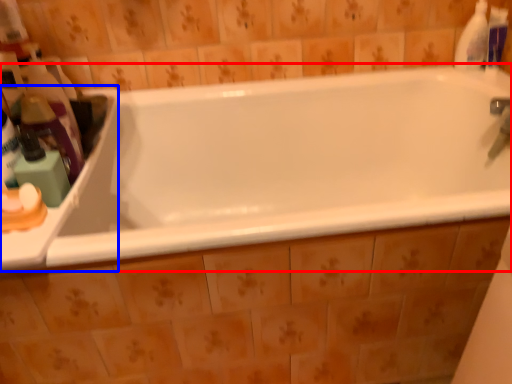
Question: Which point is closer to the camera, bathtub (highlighted by a red box) or counter top (highlighted by a blue box)?

Choices:
 (A) bathtub
 (B) counter top

Answer: (B)